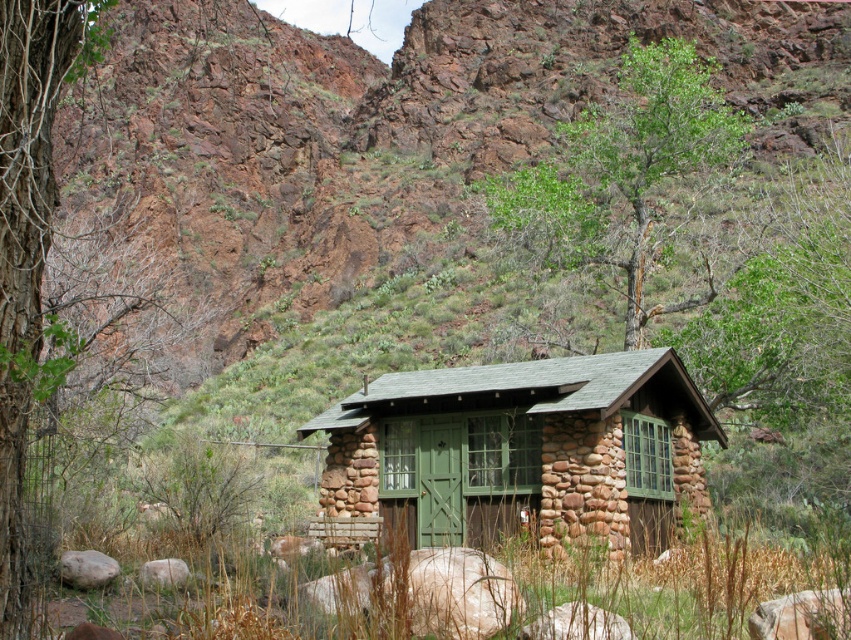
Question: Which point appears closest to the camera in this image?

Choices:
 (A) (694, 64)
 (B) (389, 548)
 (C) (391, 440)

Answer: (B)

Question: Can you confirm if green grass at center is thinner than green leafy tree at upper center?

Choices:
 (A) no
 (B) yes

Answer: (B)

Question: Among these points, which one is farthest from the camera?

Choices:
 (A) (714, 70)
 (B) (56, 99)

Answer: (A)

Question: Among these points, which one is nearest to the camera?

Choices:
 (A) (9, 294)
 (B) (666, 435)
 (C) (649, 150)
 (D) (703, 566)

Answer: (A)

Question: Can you confirm if green stone cabin at center is positioned to the left of green grass at center?

Choices:
 (A) no
 (B) yes

Answer: (B)

Question: Is green leafy tree at upper center to the left of smooth bark tree at left from the viewer's perspective?

Choices:
 (A) yes
 (B) no

Answer: (B)